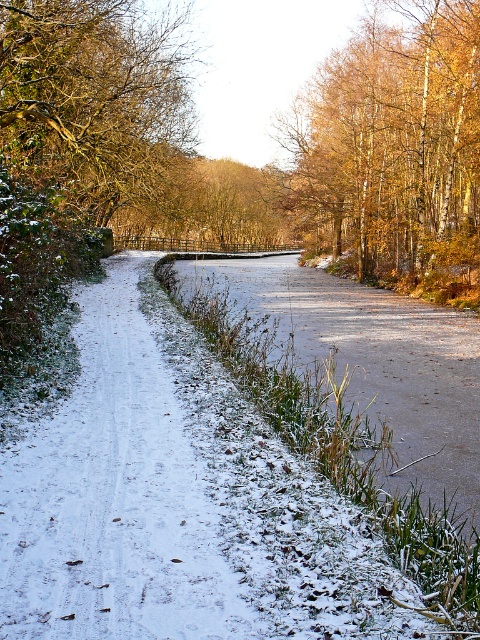
Is golden textured leaves at upper center thinner than brown leafy tree at upper left?

No, golden textured leaves at upper center is not thinner than brown leafy tree at upper left.

Describe the element at coordinates (394, 150) in the screenshot. The width and height of the screenshot is (480, 640). I see `golden textured leaves at upper center` at that location.

Is point (446, 259) closer to viewer compared to point (140, 67)?

Yes, it is.

Where is `golden textured leaves at upper center`? golden textured leaves at upper center is located at coordinates (394, 150).

Between point (4, 35) and point (399, 420), which one is positioned in front?

Point (399, 420) is more forward.

The image size is (480, 640). I want to click on brown leafy tree at upper left, so click(93, 99).

Does golden textured leaves at upper center have a greater width compared to snowy grass at center?

No, golden textured leaves at upper center is not wider than snowy grass at center.

Find the location of a particular element. The width and height of the screenshot is (480, 640). golden textured leaves at upper center is located at coordinates (394, 150).

The width and height of the screenshot is (480, 640). What are the coordinates of `golden textured leaves at upper center` in the screenshot? It's located at (394, 150).